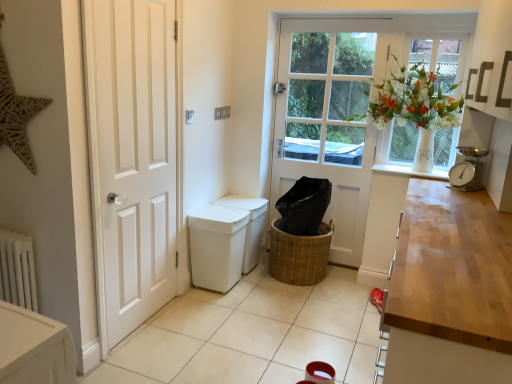
Question: Can you confirm if white matte radiator at lower left is bigger than silver metallic scale at right?

Choices:
 (A) no
 (B) yes

Answer: (B)

Question: Is silver metallic scale at right surrounded by white matte radiator at lower left?

Choices:
 (A) no
 (B) yes

Answer: (A)

Question: Is white matte radiator at lower left wider than silver metallic scale at right?

Choices:
 (A) yes
 (B) no

Answer: (B)

Question: From the image's perspective, is white matte radiator at lower left under silver metallic scale at right?

Choices:
 (A) yes
 (B) no

Answer: (A)

Question: Would you consider white matte radiator at lower left to be distant from silver metallic scale at right?

Choices:
 (A) yes
 (B) no

Answer: (A)

Question: Is silver metallic scale at right at the back of white matte radiator at lower left?

Choices:
 (A) no
 (B) yes

Answer: (A)

Question: Are white tile at center and white glass window at upper right far apart?

Choices:
 (A) yes
 (B) no

Answer: (A)

Question: Is white tile at center next to white glass window at upper right and touching it?

Choices:
 (A) yes
 (B) no

Answer: (B)

Question: From a real-world perspective, is white tile at center over white glass window at upper right?

Choices:
 (A) yes
 (B) no

Answer: (B)

Question: Is white tile at center further to the viewer compared to white glass window at upper right?

Choices:
 (A) no
 (B) yes

Answer: (A)

Question: Could you tell me if white tile at center is facing white glass window at upper right?

Choices:
 (A) no
 (B) yes

Answer: (A)

Question: From the image's perspective, is white tile at center located beneath white glass window at upper right?

Choices:
 (A) yes
 (B) no

Answer: (A)

Question: Can you confirm if silver metallic scale at right is bigger than white glossy door at left, which ranks as the 2th door in back-to-front order?

Choices:
 (A) yes
 (B) no

Answer: (B)